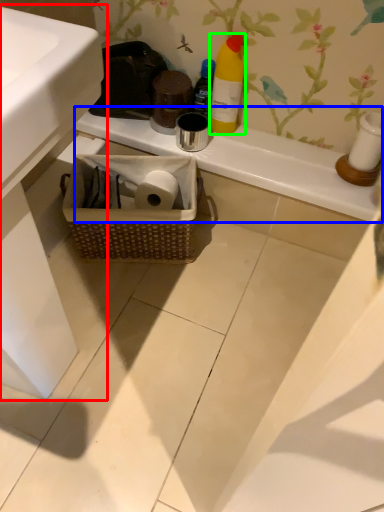
Question: Which object is the farthest from sink (highlighted by a red box)? Choose among these: counter top (highlighted by a blue box) or bottle (highlighted by a green box).

Choices:
 (A) counter top
 (B) bottle

Answer: (B)